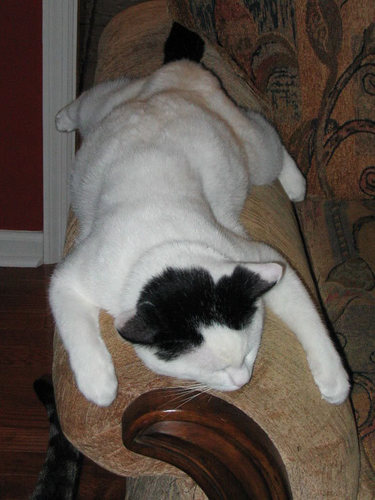
This screenshot has height=500, width=375. Find the location of `white fur`. white fur is located at coordinates (114, 254).